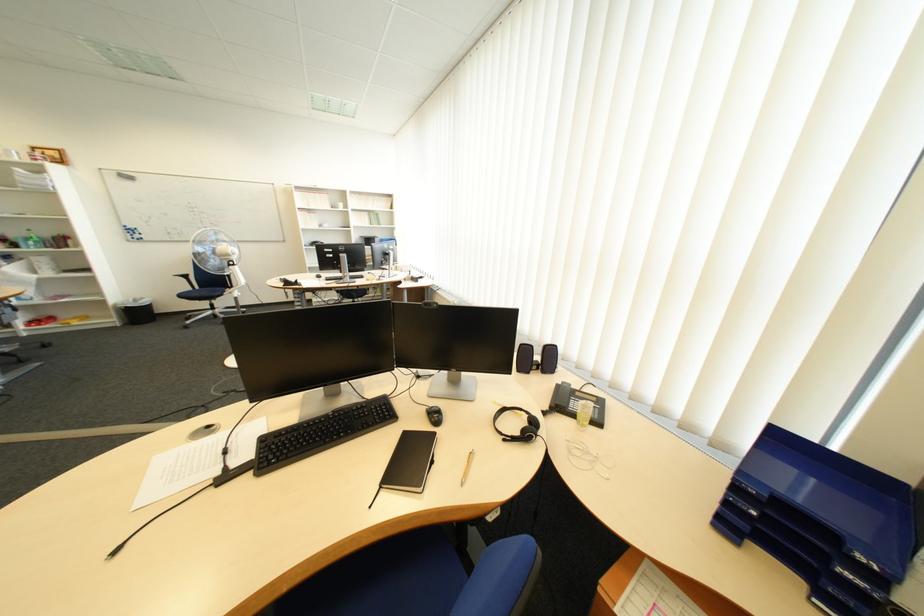
The image size is (924, 616). What do you see at coordinates (517, 424) in the screenshot?
I see `a phone handset` at bounding box center [517, 424].